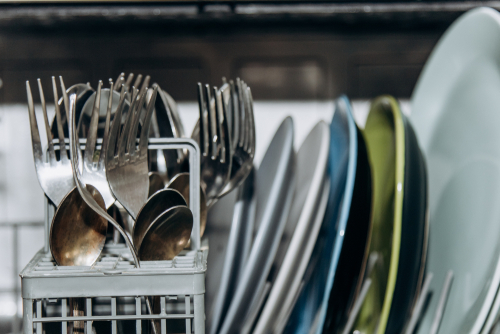
I want to click on spoons, so click(166, 241), click(157, 207), click(82, 239), click(180, 184), click(157, 179), click(85, 114), click(84, 100), click(61, 103), click(168, 120), click(177, 110).